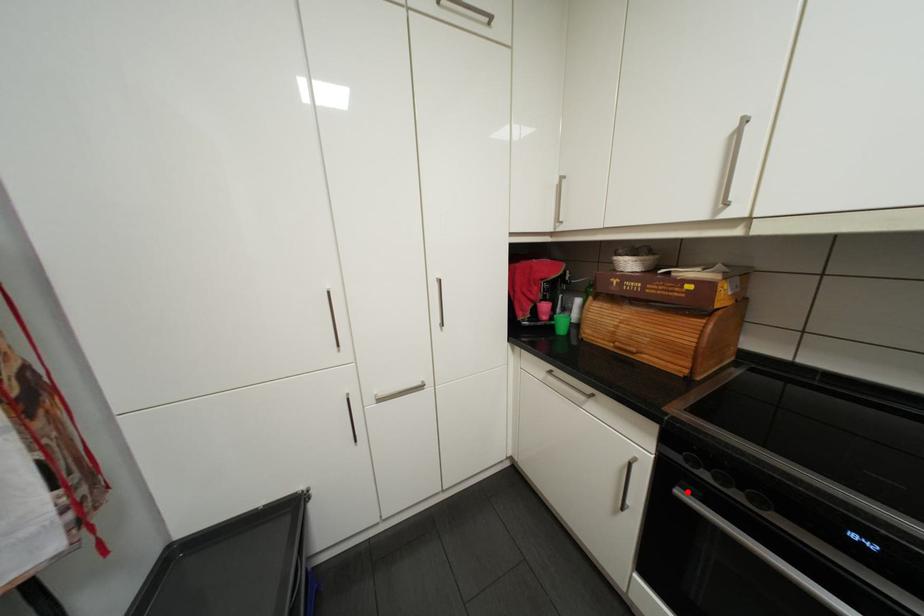
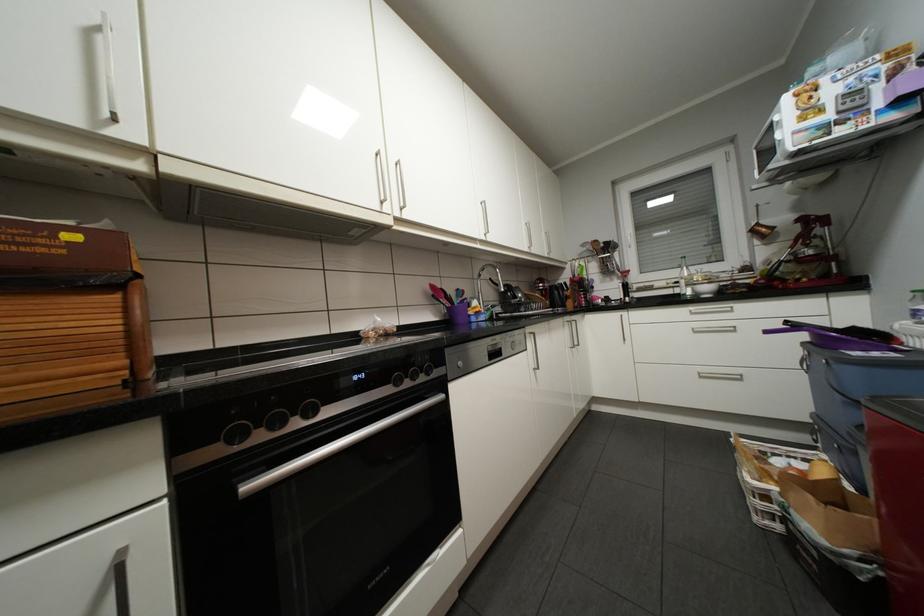
Locate, in the second image, the point that corresponds to the highlighted location in the first image.

(254, 485)